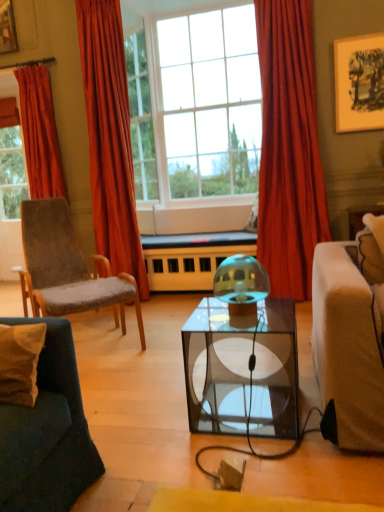
Question: Considering the relative positions of red velvet curtain at left, positioned as the first curtain in left-to-right order, and velvet orange curtain at left, which ranks as the 2th curtain in right-to-left order, in the image provided, is red velvet curtain at left, positioned as the first curtain in left-to-right order, to the left or to the right of velvet orange curtain at left, which ranks as the 2th curtain in right-to-left order,?

Choices:
 (A) left
 (B) right

Answer: (A)

Question: From the image's perspective, relative to velvet orange curtain at left, the second curtain viewed from the left, is red velvet curtain at left, the 3th curtain when ordered from right to left, above or below?

Choices:
 (A) below
 (B) above

Answer: (B)

Question: Estimate the real-world distances between objects in this image. Which object is farther from the velvet beige pillow at lower left?

Choices:
 (A) clear glass window at upper center, which is counted as the 1th window, starting from the left
 (B) wooden framed artwork at upper right
 (C) velvet orange curtain at left, the second curtain viewed from the left
 (D) transparent glass coffee table at center
 (E) clear glass window at center, which is counted as the first window, starting from the right

Answer: (A)

Question: Which object is positioned farthest from the clear glass window at center, which is counted as the first window, starting from the right?

Choices:
 (A) velvet grey chair at left
 (B) velvet orange curtain at left, which ranks as the 2th curtain in right-to-left order
 (C) transparent glass coffee table at center
 (D) clear glass window at upper center, placed as the 2th window when sorted from right to left
 (E) red velvet curtain at center, which ranks as the 1th curtain in right-to-left order

Answer: (C)